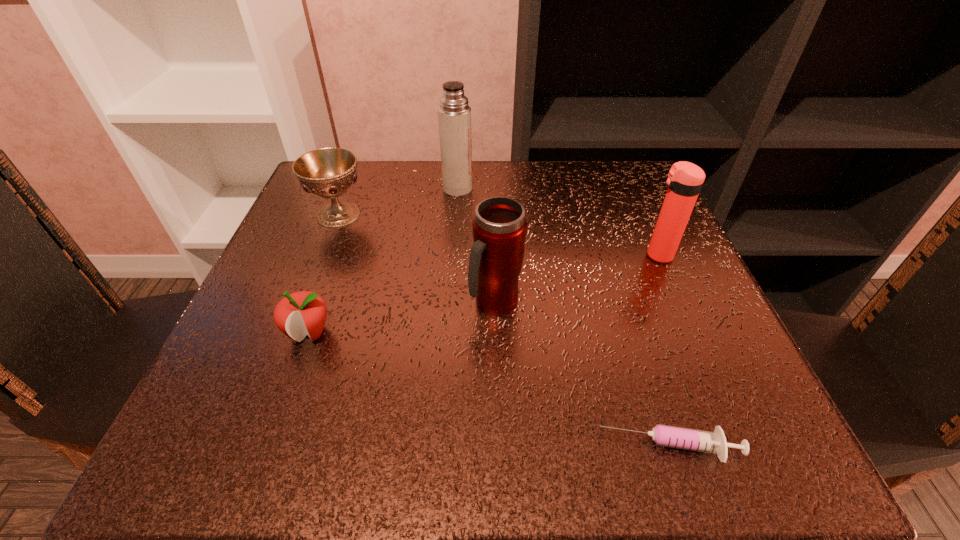
Locate an element on the screen. the farthest thermos bottle is located at coordinates (454, 114).

Image resolution: width=960 pixels, height=540 pixels. Identify the location of the farthest object. (454, 114).

Identify the location of the third farthest object. (684, 182).

The height and width of the screenshot is (540, 960). Find the location of `the rightmost thermos bottle`. the rightmost thermos bottle is located at coordinates (684, 182).

Locate an element on the screen. the nearest thermos bottle is located at coordinates (499, 227).

Find the location of a particular element. chalice is located at coordinates (327, 172).

Locate an element on the screen. The image size is (960, 540). the second farthest object is located at coordinates (327, 172).

Where is `the second shortest object`? the second shortest object is located at coordinates (298, 314).

Find the location of a particular element. The width and height of the screenshot is (960, 540). syringe is located at coordinates (714, 442).

Identify the location of the nearest object. click(714, 442).